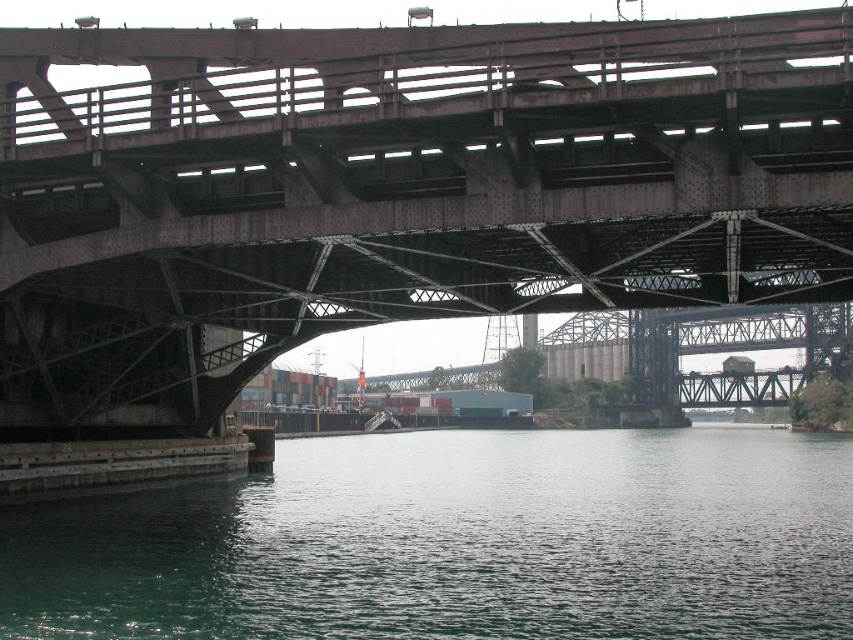
You are a delivery truck driver with a vehicle that is 4 meters tall. You need to pass under the rusty metal bridge at upper center. Based on the scene description, can your truck safely pass under the bridge without hitting it?

The distance between the rusty metal bridge at upper center and the viewer is 33.03 meters. Since this distance is much greater than the truck height of 4 meters, the truck can safely pass under the bridge without hitting it.

You are standing at the point labeled with coordinates point (399, 188) on the image. What structure are you facing directly in front of you?

The point (399, 188) indicates rusty metal bridge at upper center, so you are facing the rusty metal bridge at upper center directly in front of you.